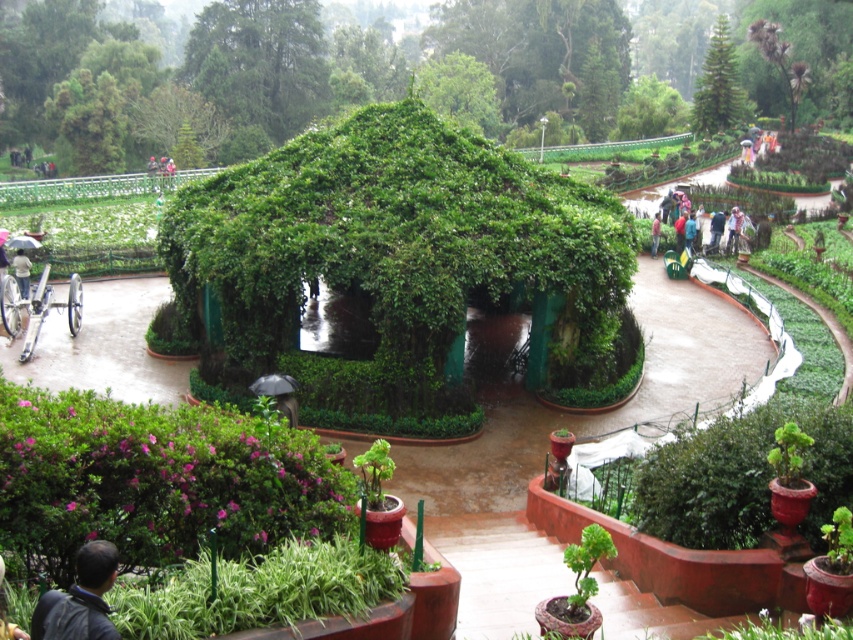
In the scene shown: Which of these two, dark blue shirt at lower left or light blue fabric umbrella at lower left, stands shorter?

dark blue shirt at lower left is shorter.

Looking at this image, who is more distant from viewer, (3, 598) or (27, 266)?

The point (27, 266) is behind.

Locate an element on the screen. dark blue shirt at lower left is located at coordinates (7, 612).

Is light blue fabric umbrella at lower left closer to the viewer compared to light blue jeans at center?

Yes, it is.

You are a GUI agent. You are given a task and a screenshot of the screen. Output one action in this format:
    pyautogui.click(x=<x>, y=<y>)
    Task: Click on the light blue fabric umbrella at lower left
    The width and height of the screenshot is (853, 640).
    Given the screenshot: What is the action you would take?
    pyautogui.click(x=21, y=272)

At what (x,y) coordinates should I click in order to perform the action: click on light blue fabric umbrella at lower left. Please return your answer as a coordinate pair (x, y). This screenshot has width=853, height=640. Looking at the image, I should click on (21, 272).

Is green leafy umbrella at center thinner than dark blue shirt at lower left?

Incorrect, green leafy umbrella at center's width is not less than dark blue shirt at lower left's.

Who is higher up, green leafy umbrella at center or dark blue shirt at lower left?

Answer: green leafy umbrella at center

Locate an element on the screen. green leafy umbrella at center is located at coordinates (714, 204).